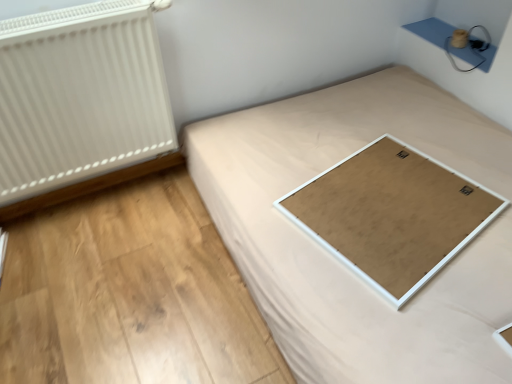
This screenshot has height=384, width=512. In order to click on free point behind white matte board at center in this screenshot , I will do `click(374, 124)`.